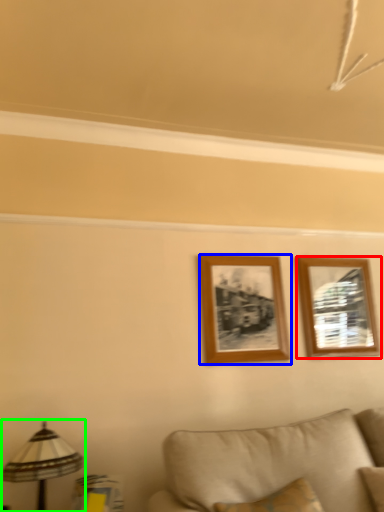
Question: Estimate the real-world distances between objects in this image. Which object is closer to picture frame (highlighted by a red box), picture frame (highlighted by a blue box) or table lamp (highlighted by a green box)?

Choices:
 (A) picture frame
 (B) table lamp

Answer: (A)